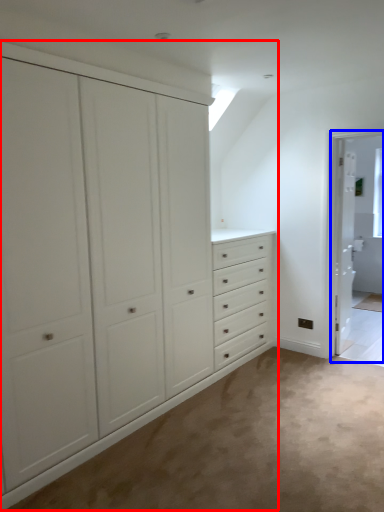
Question: Which object is further to the camera taking this photo, cupboard (highlighted by a red box) or screen door (highlighted by a blue box)?

Choices:
 (A) cupboard
 (B) screen door

Answer: (B)